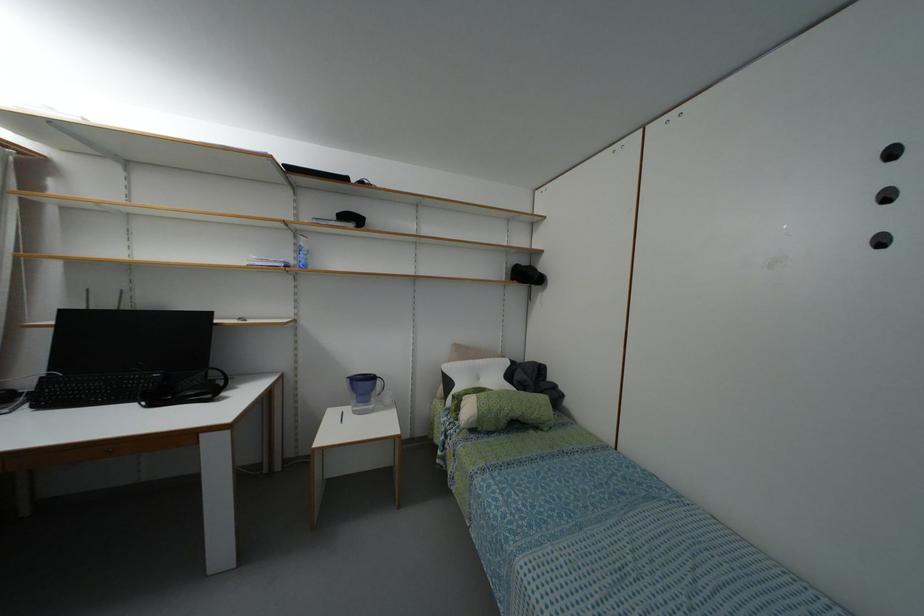
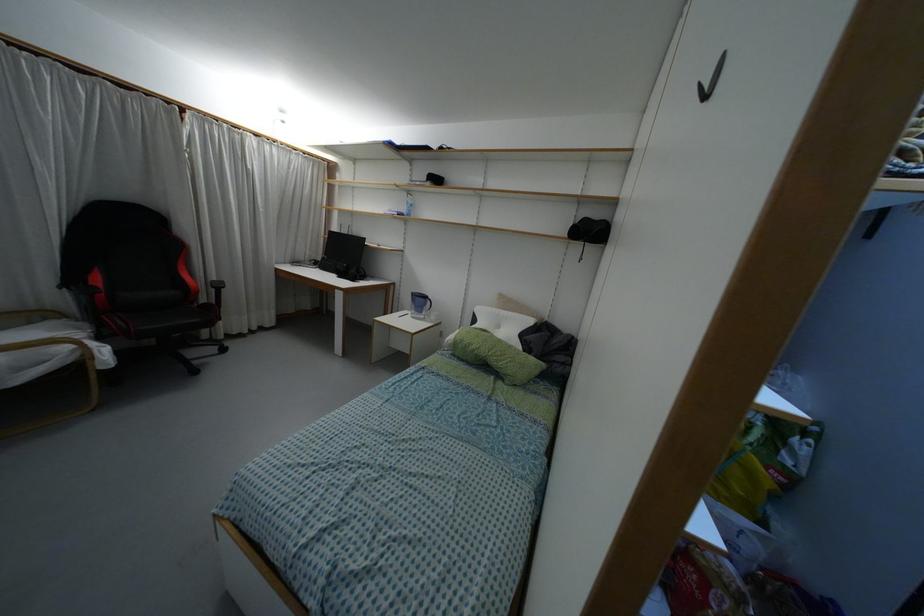
The point at (378, 382) is marked in the first image. Where is the corresponding point in the second image?

(428, 302)